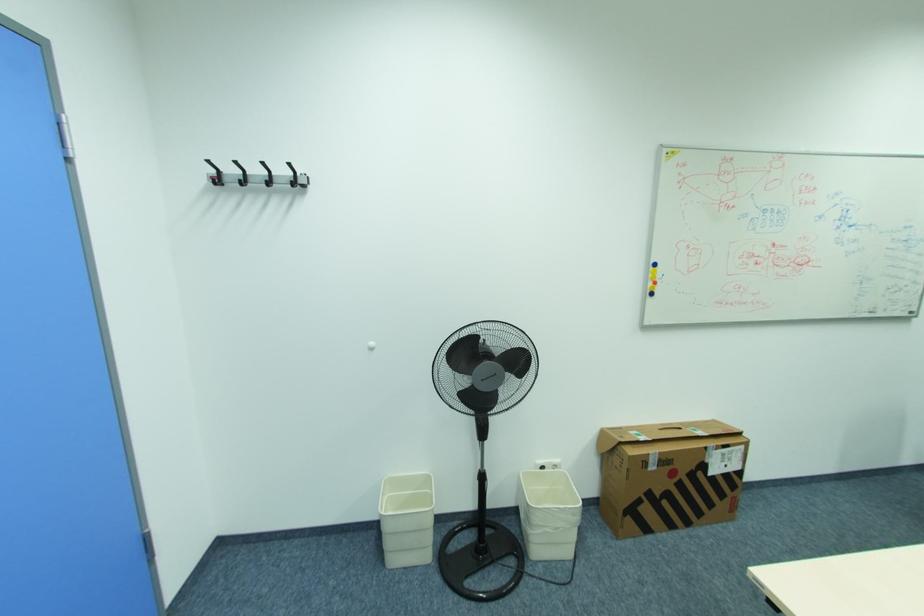
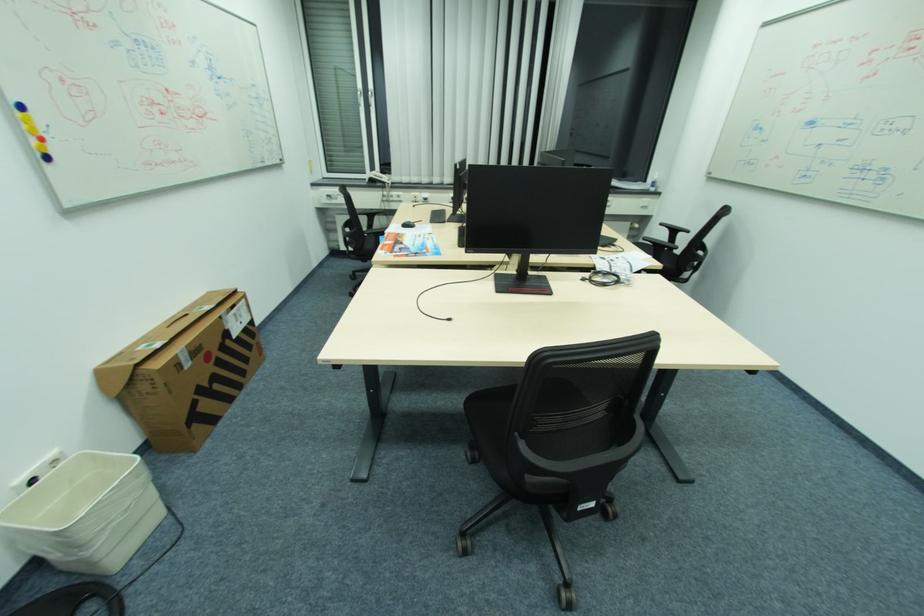
The point at (701, 431) is marked in the first image. Where is the corresponding point in the second image?

(207, 308)